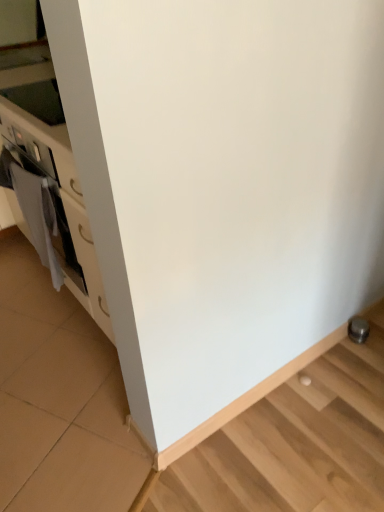
Question: Considering the relative sizes of white fabric at left and metallic silver stairwell at lower right in the image provided, is white fabric at left thinner than metallic silver stairwell at lower right?

Choices:
 (A) yes
 (B) no

Answer: (B)

Question: Can you confirm if white fabric at left is taller than metallic silver stairwell at lower right?

Choices:
 (A) yes
 (B) no

Answer: (A)

Question: Does white fabric at left have a lesser height compared to metallic silver stairwell at lower right?

Choices:
 (A) no
 (B) yes

Answer: (A)

Question: From a real-world perspective, is white fabric at left on top of metallic silver stairwell at lower right?

Choices:
 (A) no
 (B) yes

Answer: (B)

Question: Can you confirm if white fabric at left is positioned to the left of metallic silver stairwell at lower right?

Choices:
 (A) yes
 (B) no

Answer: (A)

Question: Is white fabric at left looking in the opposite direction of metallic silver stairwell at lower right?

Choices:
 (A) yes
 (B) no

Answer: (B)

Question: Is white fabric at left inside metallic silver stairwell at lower right?

Choices:
 (A) no
 (B) yes

Answer: (A)

Question: From the image's perspective, is metallic silver stairwell at lower right under white fabric at left?

Choices:
 (A) no
 (B) yes

Answer: (B)

Question: Is metallic silver stairwell at lower right wider than white fabric at left?

Choices:
 (A) yes
 (B) no

Answer: (B)

Question: From a real-world perspective, does metallic silver stairwell at lower right sit lower than white fabric at left?

Choices:
 (A) yes
 (B) no

Answer: (A)

Question: Would you say metallic silver stairwell at lower right is a long distance from white fabric at left?

Choices:
 (A) yes
 (B) no

Answer: (A)

Question: Is metallic silver stairwell at lower right bigger than white fabric at left?

Choices:
 (A) yes
 (B) no

Answer: (B)

Question: Based on their sizes in the image, would you say white fabric at left is bigger or smaller than metallic silver stairwell at lower right?

Choices:
 (A) big
 (B) small

Answer: (A)